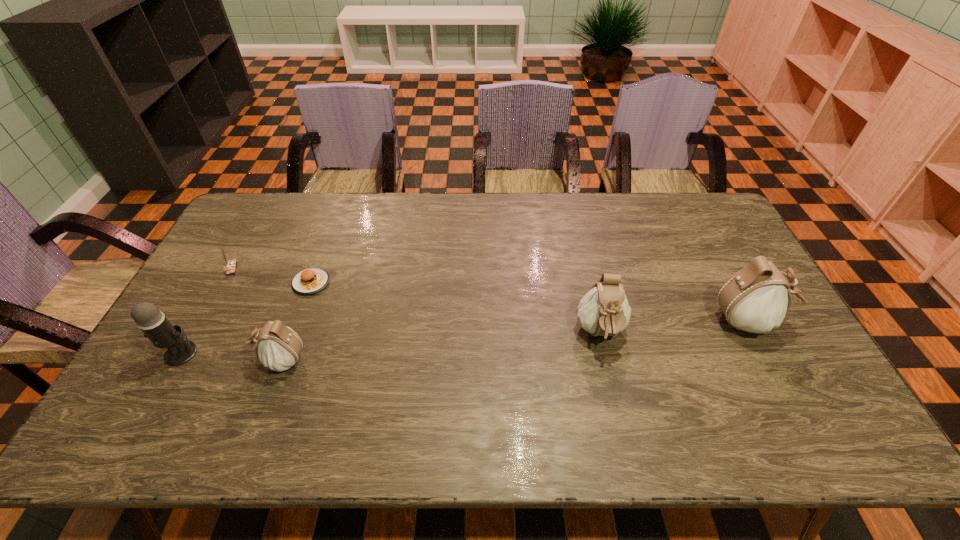
Find the location of a particular element. The height and width of the screenshot is (540, 960). vacant area located on the front-facing side of the fourth tallest object is located at coordinates (190, 360).

Identify the location of free location located 0.150m on the front-facing side of the fourth tallest object. This screenshot has width=960, height=540. (198, 360).

Locate an element on the screen. The height and width of the screenshot is (540, 960). free region located 0.120m on the front-facing side of the second pouch from right to left is located at coordinates (615, 401).

You are a GUI agent. You are given a task and a screenshot of the screen. Output one action in this format:
    pyautogui.click(x=<x>, y=<y>)
    Task: Click on the blank area located on the right of the matchbox
    
    Given the screenshot: What is the action you would take?
    point(286,269)

At what (x,y) coordinates should I click in order to perform the action: click on blank space located 0.080m on the front of the microphone. Please return your answer as a coordinate pair (x, y). Looking at the image, I should click on (158, 394).

Where is `free point located on the back of the food`? free point located on the back of the food is located at coordinates (323, 252).

Where is `object that is at the near edge`? Image resolution: width=960 pixels, height=540 pixels. object that is at the near edge is located at coordinates (278, 347).

Locate an element on the screen. Image resolution: width=960 pixels, height=540 pixels. matchbox that is at the left edge is located at coordinates (231, 265).

Where is `microphone that is at the left edge`? The image size is (960, 540). microphone that is at the left edge is located at coordinates (x=152, y=322).

Locate an element on the screen. The image size is (960, 540). object that is at the right edge is located at coordinates (755, 299).